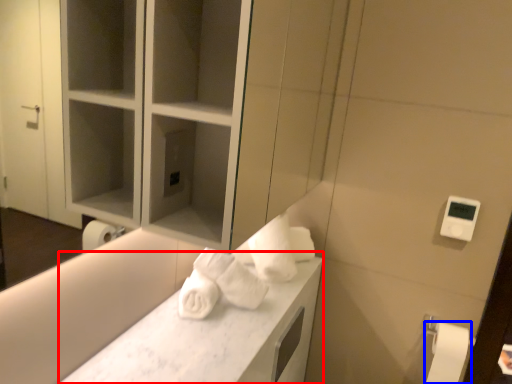
Question: Among these objects, which one is nearest to the camera, counter top (highlighted by a red box) or toilet paper (highlighted by a blue box)?

Choices:
 (A) counter top
 (B) toilet paper

Answer: (A)